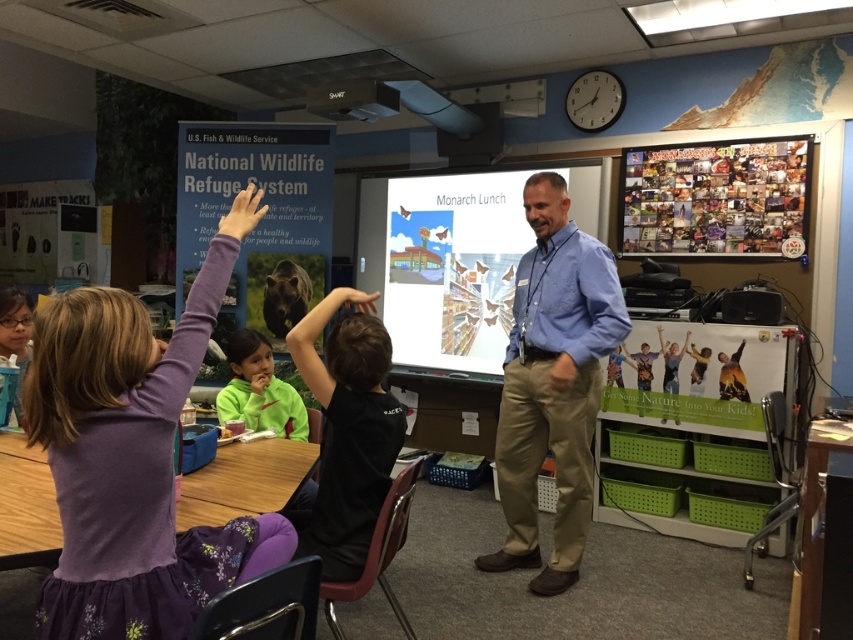
You are a teacher in the classroom and want to ensure that all students can see the blue shirt at center and the multicolored collage at upper right. Which object is bigger and might be more visible to the students?

The blue shirt at center is larger in size than multicolored collage at upper right, so it is bigger and might be more visible to the students.

You are a teacher in the classroom and want to call on the student wearing the purple fabric dress at left. Where should you look to find them?

The purple fabric dress at left is located at point (132, 460) in the image coordinates.